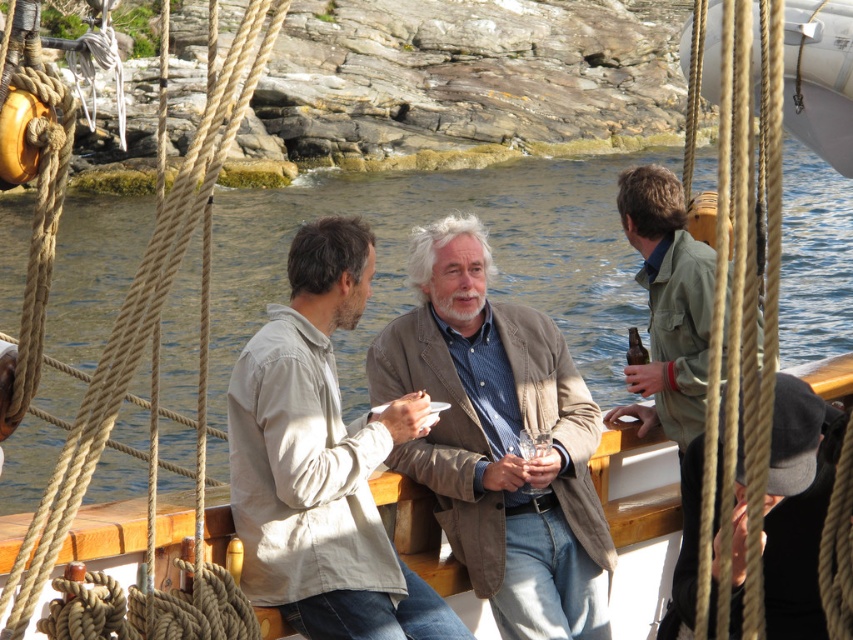
Question: Considering the real-world distances, which object is closest to the light brown cotton shirt at center?

Choices:
 (A) green canvas jacket at right
 (B) matte brown blazer at center

Answer: (B)

Question: Can you confirm if matte brown blazer at center is positioned to the right of green canvas jacket at right?

Choices:
 (A) yes
 (B) no

Answer: (B)

Question: Does matte brown blazer at center appear over green canvas jacket at right?

Choices:
 (A) no
 (B) yes

Answer: (A)

Question: Can you confirm if matte brown blazer at center is bigger than black wool cap at lower right?

Choices:
 (A) no
 (B) yes

Answer: (B)

Question: Based on their relative distances, which object is nearer to the matte brown blazer at center?

Choices:
 (A) light brown cotton shirt at center
 (B) green canvas jacket at right

Answer: (B)

Question: Which object is closer to the camera taking this photo?

Choices:
 (A) light brown cotton shirt at center
 (B) matte brown blazer at center
 (C) green canvas jacket at right

Answer: (C)